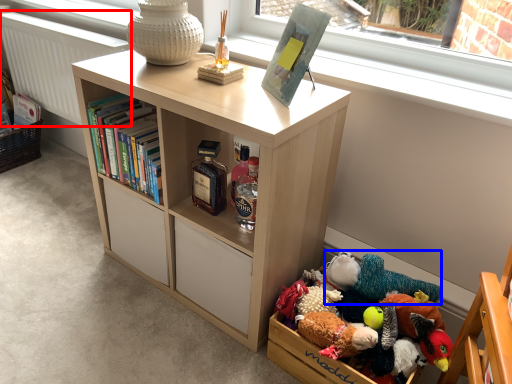
Question: Which object appears farthest to the camera in this image, radiator (highlighted by a red box) or toy (highlighted by a blue box)?

Choices:
 (A) radiator
 (B) toy

Answer: (A)